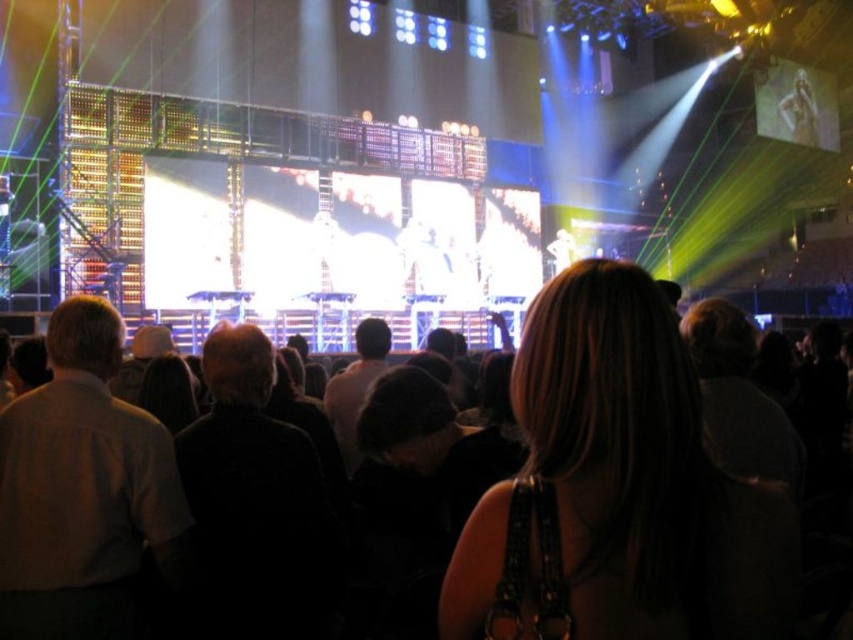
Question: Is light brown shirt at left in front of dark gray sweater at center?

Choices:
 (A) no
 (B) yes

Answer: (B)

Question: Among these objects, which one is farthest from the camera?

Choices:
 (A) light brown shirt at left
 (B) dark hair at center

Answer: (B)

Question: Which object is farther from the camera taking this photo?

Choices:
 (A) dark gray sweater at center
 (B) dark hair at center
 (C) light brown shirt at left

Answer: (B)

Question: Is dark gray sweater at center to the left of dark hair at center from the viewer's perspective?

Choices:
 (A) yes
 (B) no

Answer: (A)

Question: Does dark gray sweater at center come in front of dark hair at center?

Choices:
 (A) no
 (B) yes

Answer: (B)

Question: Which point is farther from the camera taking this photo?

Choices:
 (A) (351, 452)
 (B) (289, 536)

Answer: (A)